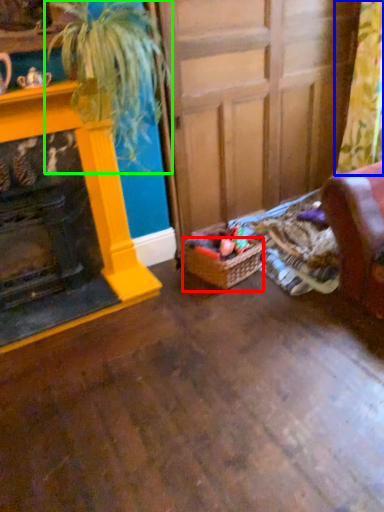
Question: Considering the real-world distances, which object is closest to basket (highlighted by a red box)? curtain (highlighted by a blue box) or houseplant (highlighted by a green box).

Choices:
 (A) curtain
 (B) houseplant

Answer: (B)